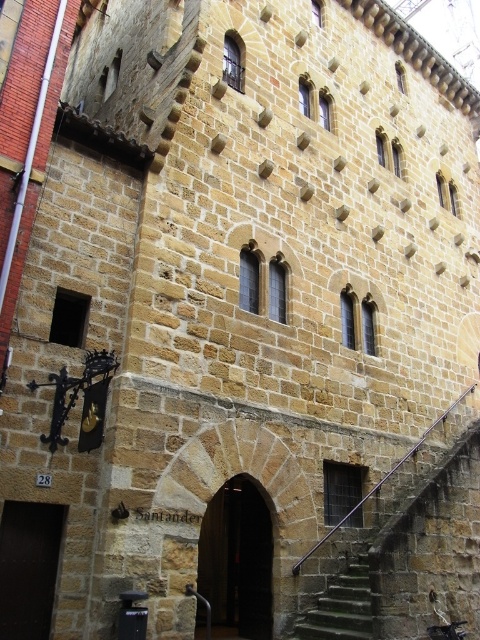
In the scene shown: You are standing in front of the historic stone building and want to enter through the dark brown wooden door at lower left. However, you notice that the green mossy stone stairs at lower right might block your path. Can you walk directly to the door without going up the stairs?

The green mossy stone stairs at lower right are to the right of the dark brown wooden door at lower left, so they are positioned next to the door rather than blocking it. You can walk directly to the dark brown wooden door at lower left without needing to go up the stairs.

You are standing in front of the historic stone building and want to take a photo. There are two points marked on the building that you need to focus on. The first point is located at coordinates point (458, 604), and the second point is at point (13, 618). Since you want both points in focus, which point should you focus on first to ensure the other is also in focus?

You should focus on point (458, 604) first because it is closer to you than point (13, 618). By focusing on the closer point, the farther point will also be in focus if the depth of field is sufficient.